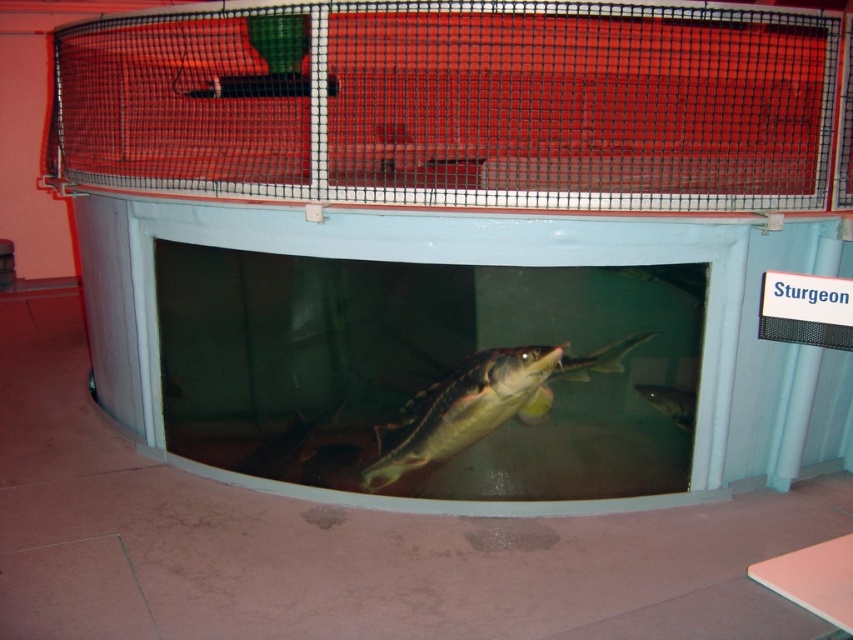
Between transparent plastic cage at upper center and shiny silver fish at lower center, which one has less height?

shiny silver fish at lower center

Between point (408, 90) and point (672, 396), which one is positioned in front?

Point (672, 396)

Image resolution: width=853 pixels, height=640 pixels. Identify the location of transparent plastic cage at upper center. (457, 104).

Is the position of transparent plastic cage at upper center less distant than that of shiny silver fish at center?

Yes.

Does transparent plastic cage at upper center appear on the right side of shiny silver fish at center?

Yes, transparent plastic cage at upper center is to the right of shiny silver fish at center.

Is point (332, 6) in front of point (480, 388)?

Yes, it is.

Identify the location of transparent plastic cage at upper center. (457, 104).

Looking at this image, between shiny silver fish at center and shiny silver sturgeon at center, which one appears on the left side from the viewer's perspective?

shiny silver fish at center

Can you confirm if shiny silver fish at center is shorter than shiny silver sturgeon at center?

No, shiny silver fish at center is not shorter than shiny silver sturgeon at center.

Which is behind, point (532, 417) or point (578, 356)?

Point (532, 417)

Where is `shiny silver fish at center`? Image resolution: width=853 pixels, height=640 pixels. shiny silver fish at center is located at coordinates (463, 410).